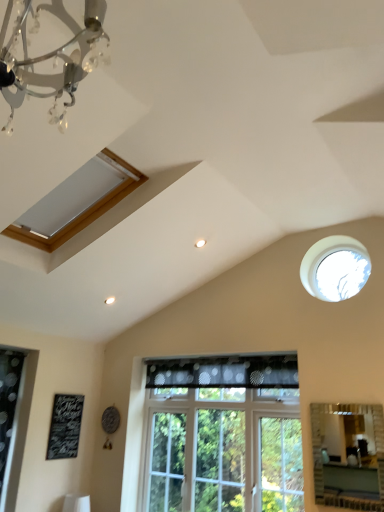
What do you see at coordinates (348, 455) in the screenshot? The height and width of the screenshot is (512, 384). I see `matte silver mirror at lower right` at bounding box center [348, 455].

Measure the distance between clear glass window at center, the 3th window from the top, and camera.

clear glass window at center, the 3th window from the top, and camera are 9.76 feet apart.

Measure the distance between point (80, 183) and camera.

A distance of 8.34 feet exists between point (80, 183) and camera.

What do you see at coordinates (76, 202) in the screenshot? I see `matte wooden window at upper left, placed as the third window when sorted from bottom to top` at bounding box center [76, 202].

What do you see at coordinates (224, 372) in the screenshot? I see `black dotted fabric at center` at bounding box center [224, 372].

Where is `matte silver mirror at lower right`? The height and width of the screenshot is (512, 384). matte silver mirror at lower right is located at coordinates (348, 455).

Can you confirm if matte silver mirror at lower right is positioned to the right of matte wooden window at upper left, which ranks as the first window in left-to-right order?

Yes.

Does point (320, 406) come farther from viewer compared to point (85, 174)?

Yes, it is.

Can we say matte silver mirror at lower right lies outside matte wooden window at upper left, which ranks as the first window in left-to-right order?

Yes.

What's the angular difference between black chalkboard at lower left and transparent glass window at upper right, which is the 3th window in left-to-right order,'s facing directions?

black chalkboard at lower left and transparent glass window at upper right, which is the 3th window in left-to-right order, are facing 90.3 degrees away from each other.

From the image's perspective, which is below, black chalkboard at lower left or transparent glass window at upper right, which is counted as the 1th window, starting from the right?

black chalkboard at lower left.

From the picture: Could you tell me if black chalkboard at lower left is turned towards transparent glass window at upper right, which is the 3th window in left-to-right order?

Yes, black chalkboard at lower left is oriented towards transparent glass window at upper right, which is the 3th window in left-to-right order.

Is black chalkboard at lower left beside transparent glass window at upper right, which ranks as the 2th window in bottom-to-top order?

No, black chalkboard at lower left is not next to transparent glass window at upper right, which ranks as the 2th window in bottom-to-top order.

Is black chalkboard at lower left facing towards matte silver mirror at lower right?

Yes, black chalkboard at lower left faces towards matte silver mirror at lower right.

From the picture: Is matte silver mirror at lower right inside black chalkboard at lower left?

No, matte silver mirror at lower right is located outside of black chalkboard at lower left.

You are a GUI agent. You are given a task and a screenshot of the screen. Output one action in this format:
    pyautogui.click(x=<x>, y=<y>)
    Task: Click on the mirror that appears below the black chalkboard at lower left (from a real-world perspective)
    This screenshot has height=512, width=384.
    Given the screenshot: What is the action you would take?
    pyautogui.click(x=348, y=455)

In the scene shown: In terms of width, does matte wooden window at upper left, which appears as the first window when viewed from the top, look wider or thinner when compared to black chalkboard at lower left?

Clearly, matte wooden window at upper left, which appears as the first window when viewed from the top, has more width compared to black chalkboard at lower left.

Can you confirm if matte wooden window at upper left, which appears as the first window when viewed from the top, is shorter than black chalkboard at lower left?

Yes, matte wooden window at upper left, which appears as the first window when viewed from the top, is shorter than black chalkboard at lower left.

Between matte wooden window at upper left, the 3th window viewed from the right, and black chalkboard at lower left, which one appears on the right side from the viewer's perspective?

Positioned to the right is matte wooden window at upper left, the 3th window viewed from the right.

Is matte wooden window at upper left, which ranks as the first window in left-to-right order, facing towards black chalkboard at lower left?

No, matte wooden window at upper left, which ranks as the first window in left-to-right order, is not facing towards black chalkboard at lower left.

Between clear glass window at center, the 3th window from the top, and black dotted fabric at center, which one has larger width?

Wider between the two is black dotted fabric at center.

Considering their positions, is clear glass window at center, the 2th window when ordered from left to right, located in front of or behind black dotted fabric at center?

clear glass window at center, the 2th window when ordered from left to right, is in front of black dotted fabric at center.

Which of these two, clear glass window at center, the 3th window from the top, or black dotted fabric at center, stands shorter?

black dotted fabric at center.

Is matte silver mirror at lower right wider than clear glass window at center, the 1th window when ordered from bottom to top?

No, matte silver mirror at lower right is not wider than clear glass window at center, the 1th window when ordered from bottom to top.

Could you measure the distance between matte silver mirror at lower right and clear glass window at center, the 3th window from the top?

29.52 inches.

Is clear glass window at center, the 2th window when ordered from left to right, at the back of matte silver mirror at lower right?

matte silver mirror at lower right does not have its back to clear glass window at center, the 2th window when ordered from left to right.

From a real-world perspective, is matte silver mirror at lower right on clear glass window at center, the 2th window when ordered from left to right?

Incorrect, from a real-world perspective, matte silver mirror at lower right is lower than clear glass window at center, the 2th window when ordered from left to right.

Is black dotted fabric at center looking in the opposite direction of clear glass window at center, the 1th window when ordered from bottom to top?

Yes, black dotted fabric at center is facing away from clear glass window at center, the 1th window when ordered from bottom to top.

From the image's perspective, does black dotted fabric at center appear higher than clear glass window at center, the 3th window from the top?

Indeed, from the image's perspective, black dotted fabric at center is shown above clear glass window at center, the 3th window from the top.

Which of these two, black dotted fabric at center or clear glass window at center, arranged as the 2th window when viewed from the right, is wider?

black dotted fabric at center is wider.

Would you say black dotted fabric at center is to the left or to the right of clear glass window at center, arranged as the 2th window when viewed from the right, in the picture?

Based on their positions, black dotted fabric at center is located to the right of clear glass window at center, arranged as the 2th window when viewed from the right.

Image resolution: width=384 pixels, height=512 pixels. In order to click on the 2nd window counting from the left of the matte silver mirror at lower right in this screenshot , I will do `click(76, 202)`.

The image size is (384, 512). I want to click on window that is the 1st one when counting upward from the black chalkboard at lower left (from the image's perspective), so click(335, 268).

Looking at the image, which one is located further to clear glass window at center, the 2th window when ordered from left to right, matte silver mirror at lower right or black dotted fabric at center?

matte silver mirror at lower right.

Estimate the real-world distances between objects in this image. Which object is closer to matte wooden window at upper left, which appears as the first window when viewed from the top, clear glass window at center, arranged as the 2th window when viewed from the right, or matte silver mirror at lower right?

The object closer to matte wooden window at upper left, which appears as the first window when viewed from the top, is clear glass window at center, arranged as the 2th window when viewed from the right.

Which object lies further to the anchor point clear glass window at center, the 3th window from the top, black dotted fabric at center or transparent glass window at upper right, which is the 3th window in left-to-right order?

The object further to clear glass window at center, the 3th window from the top, is transparent glass window at upper right, which is the 3th window in left-to-right order.

When comparing their distances from black dotted fabric at center, does clear glass window at center, the 1th window when ordered from bottom to top, or matte silver mirror at lower right seem further?

The object further to black dotted fabric at center is matte silver mirror at lower right.

Which object lies nearer to the anchor point transparent glass window at upper right, which is counted as the 1th window, starting from the right, matte silver mirror at lower right or black chalkboard at lower left?

matte silver mirror at lower right lies closer to transparent glass window at upper right, which is counted as the 1th window, starting from the right, than the other object.

Which object lies nearer to the anchor point black chalkboard at lower left, black dotted fabric at center or transparent glass window at upper right, arranged as the second window when viewed from the top?

black dotted fabric at center.

Consider the image. Considering their positions, is black chalkboard at lower left positioned closer to matte wooden window at upper left, which appears as the first window when viewed from the top, than matte silver mirror at lower right?

black chalkboard at lower left lies closer to matte wooden window at upper left, which appears as the first window when viewed from the top, than the other object.

Looking at this image, based on their spatial positions, is matte wooden window at upper left, which appears as the first window when viewed from the top, or transparent glass window at upper right, which ranks as the 2th window in bottom-to-top order, further from matte silver mirror at lower right?

The object further to matte silver mirror at lower right is matte wooden window at upper left, which appears as the first window when viewed from the top.

This screenshot has height=512, width=384. What are the coordinates of `curtain between matte wooden window at upper left, which appears as the first window when viewed from the top, and matte silver mirror at lower right, in the horizontal direction` in the screenshot? It's located at (224, 372).

The height and width of the screenshot is (512, 384). I want to click on curtain between black chalkboard at lower left and transparent glass window at upper right, which is counted as the 1th window, starting from the right, from left to right, so click(x=224, y=372).

Locate an element on the screen. Image resolution: width=384 pixels, height=512 pixels. curtain that lies between matte wooden window at upper left, which appears as the first window when viewed from the top, and black chalkboard at lower left from top to bottom is located at coordinates (224, 372).

Identify the location of curtain between clear glass window at center, the 3th window from the top, and matte silver mirror at lower right, in the horizontal direction. This screenshot has width=384, height=512. (224, 372).